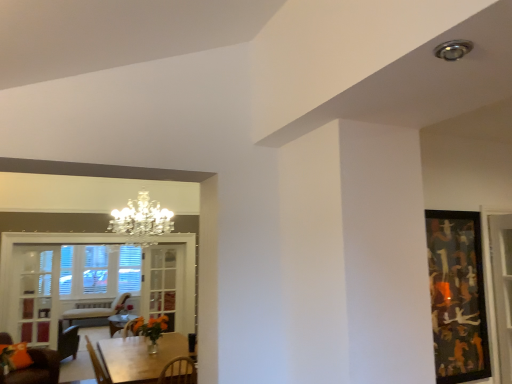
This screenshot has width=512, height=384. What are the coordinates of `orange matte vase at center` in the screenshot? It's located at (151, 327).

Describe the element at coordinates (36, 369) in the screenshot. I see `velvet orange cushion at lower left` at that location.

This screenshot has height=384, width=512. What do you see at coordinates (92, 279) in the screenshot? I see `clear glass window at lower left` at bounding box center [92, 279].

This screenshot has width=512, height=384. What are the coordinates of `clear glass door at center, which is the second glass door from left to right` in the screenshot? It's located at (163, 282).

Locate an element on the screen. This screenshot has height=384, width=512. picture frame that is above the velvet orange cushion at lower left (from the image's perspective) is located at coordinates (457, 296).

From the image's perspective, which is below, abstract painting at right or velvet orange cushion at lower left?

velvet orange cushion at lower left.

Is the surface of abstract painting at right in direct contact with velvet orange cushion at lower left?

No, abstract painting at right is not in contact with velvet orange cushion at lower left.

Based on the photo, from a real-world perspective, does orange matte vase at center sit lower than abstract painting at right?

Yes, from a real-world perspective, orange matte vase at center is beneath abstract painting at right.

Does orange matte vase at center have a lesser height compared to abstract painting at right?

Yes, orange matte vase at center is shorter than abstract painting at right.

Is orange matte vase at center facing away from abstract painting at right?

No.

Which object is positioned more to the left, orange matte vase at center or abstract painting at right?

Positioned to the left is orange matte vase at center.

Does wooden table at lower left turn towards clear glass window at lower left?

No, wooden table at lower left is not turned towards clear glass window at lower left.

Between wooden table at lower left and clear glass window at lower left, which one has smaller width?

clear glass window at lower left is thinner.

Does wooden table at lower left have a greater height compared to clear glass window at lower left?

No.

Would you say wooden table at lower left is inside or outside clear glass window at lower left?

wooden table at lower left cannot be found inside clear glass window at lower left.

From the image's perspective, is clear glass door at center, which is the second glass door from left to right, on top of velvet orange cushion at lower left?

Correct, clear glass door at center, which is the second glass door from left to right, appears higher than velvet orange cushion at lower left in the image.

Is the surface of clear glass door at center, which is the first glass door from back to front, in direct contact with velvet orange cushion at lower left?

No, clear glass door at center, which is the first glass door from back to front, is not with velvet orange cushion at lower left.

Is clear glass door at center, placed as the second glass door when sorted from front to back, oriented towards velvet orange cushion at lower left?

No.

Is point (189, 265) farther from viewer compared to point (156, 325)?

That is True.

From a real-world perspective, does clear glass window at lower left sit lower than orange matte vase at center?

No.

Is clear glass window at lower left taller than orange matte vase at center?

Yes, clear glass window at lower left is taller than orange matte vase at center.

Can you confirm if clear glass window at lower left is positioned to the right of orange matte vase at center?

In fact, clear glass window at lower left is to the left of orange matte vase at center.

Measure the distance between velvet orange cushion at lower left and orange matte vase at center.

velvet orange cushion at lower left is 4.41 feet away from orange matte vase at center.

Who is bigger, velvet orange cushion at lower left or orange matte vase at center?

velvet orange cushion at lower left is bigger.

Where is `flower that is above the velvet orange cushion at lower left (from a real-world perspective)`? flower that is above the velvet orange cushion at lower left (from a real-world perspective) is located at coordinates (151, 327).

Is velvet orange cushion at lower left completely or partially outside of orange matte vase at center?

Absolutely, velvet orange cushion at lower left is external to orange matte vase at center.

Considering the sizes of objects clear glass cabinet at left, which is the 2th glass door in back-to-front order, and wooden table at lower left in the image provided, who is shorter, clear glass cabinet at left, which is the 2th glass door in back-to-front order, or wooden table at lower left?

With less height is wooden table at lower left.

How different are the orientations of clear glass cabinet at left, which is the 2th glass door in back-to-front order, and wooden table at lower left in degrees?

0.0913 degrees separate the facing orientations of clear glass cabinet at left, which is the 2th glass door in back-to-front order, and wooden table at lower left.

Does point (19, 262) appear closer or farther from the camera than point (108, 346)?

Point (19, 262) is farther from the camera than point (108, 346).

Between clear glass cabinet at left, acting as the 2th glass door starting from the right, and wooden table at lower left, which one appears on the right side from the viewer's perspective?

Positioned to the right is wooden table at lower left.

At what (x,y) coordinates should I click in order to perform the action: click on picture frame above the velvet orange cushion at lower left (from the image's perspective). Please return your answer as a coordinate pair (x, y). Looking at the image, I should click on (457, 296).

Find the location of a particular element. The height and width of the screenshot is (384, 512). picture frame on the right of orange matte vase at center is located at coordinates (457, 296).

From the image, which object appears to be farther from clear glass cabinet at left, acting as the 2th glass door starting from the right, clear glass door at center, which is the second glass door from left to right, or abstract painting at right?

abstract painting at right is further to clear glass cabinet at left, acting as the 2th glass door starting from the right.

Looking at the image, which one is located closer to abstract painting at right, velvet orange cushion at lower left or clear glass door at center, which is the first glass door from back to front?

clear glass door at center, which is the first glass door from back to front.

Based on their spatial positions, is wooden table at lower left or velvet orange cushion at lower left further from abstract painting at right?

The object further to abstract painting at right is velvet orange cushion at lower left.

From the image, which object appears to be farther from clear glass cabinet at left, acting as the 2th glass door starting from the right, wooden table at lower left or velvet orange cushion at lower left?

The object further to clear glass cabinet at left, acting as the 2th glass door starting from the right, is wooden table at lower left.

Looking at the image, which one is located further to velvet orange cushion at lower left, clear glass door at center, the first glass door in the right-to-left sequence, or orange matte vase at center?

Among the two, clear glass door at center, the first glass door in the right-to-left sequence, is located further to velvet orange cushion at lower left.

Estimate the real-world distances between objects in this image. Which object is closer to clear glass window at lower left, clear glass cabinet at left, acting as the 2th glass door starting from the right, or abstract painting at right?

clear glass cabinet at left, acting as the 2th glass door starting from the right, is closer to clear glass window at lower left.

When comparing their distances from orange matte vase at center, does wooden table at lower left or velvet orange cushion at lower left seem closer?

wooden table at lower left is closer to orange matte vase at center.

Based on their spatial positions, is orange matte vase at center or velvet orange cushion at lower left closer to clear glass window at lower left?

velvet orange cushion at lower left is closer to clear glass window at lower left.

The image size is (512, 384). What are the coordinates of `flower between velvet orange cushion at lower left and wooden table at lower left` in the screenshot? It's located at click(x=151, y=327).

This screenshot has height=384, width=512. What are the coordinates of `window located between wooden table at lower left and clear glass cabinet at left, which is the 2th glass door in back-to-front order, in the depth direction` in the screenshot? It's located at (92, 279).

At what (x,y) coordinates should I click in order to perform the action: click on window between clear glass cabinet at left, acting as the 1th glass door starting from the front, and orange matte vase at center. Please return your answer as a coordinate pair (x, y). The image size is (512, 384). Looking at the image, I should click on (92, 279).

Find the location of a particular element. The height and width of the screenshot is (384, 512). window situated between velvet orange cushion at lower left and abstract painting at right from left to right is located at coordinates (92, 279).